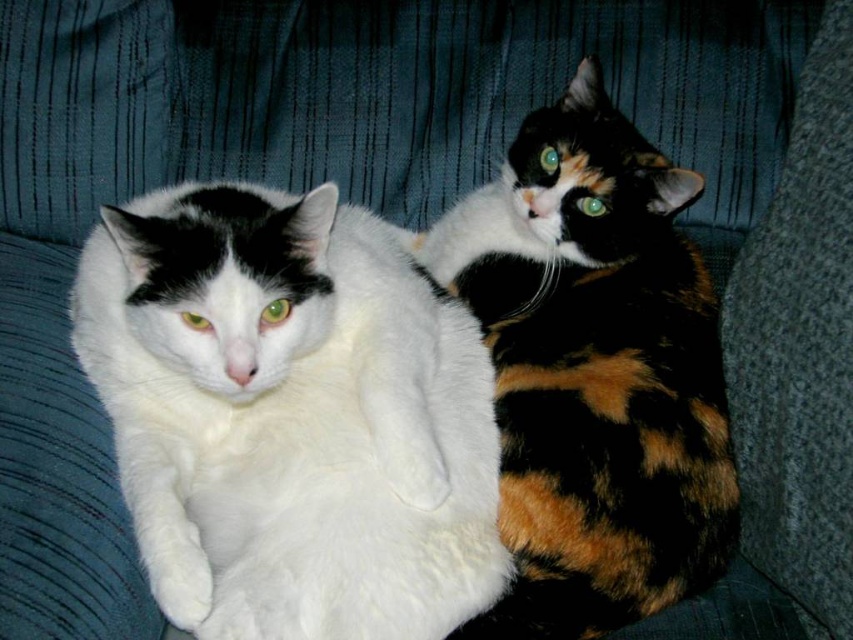
Question: Does white fluffy cat at left have a greater width compared to calico fur cat at right?

Choices:
 (A) no
 (B) yes

Answer: (B)

Question: Which of the following is the farthest from the observer?

Choices:
 (A) calico fur cat at right
 (B) white fluffy cat at left

Answer: (A)

Question: Does white fluffy cat at left appear on the left side of calico fur cat at right?

Choices:
 (A) no
 (B) yes

Answer: (B)

Question: Can you confirm if white fluffy cat at left is bigger than calico fur cat at right?

Choices:
 (A) no
 (B) yes

Answer: (B)

Question: Which object is farther from the camera taking this photo?

Choices:
 (A) calico fur cat at right
 (B) white fluffy cat at left

Answer: (A)

Question: Which point appears farthest from the camera in this image?

Choices:
 (A) pos(369,330)
 (B) pos(637,570)

Answer: (A)